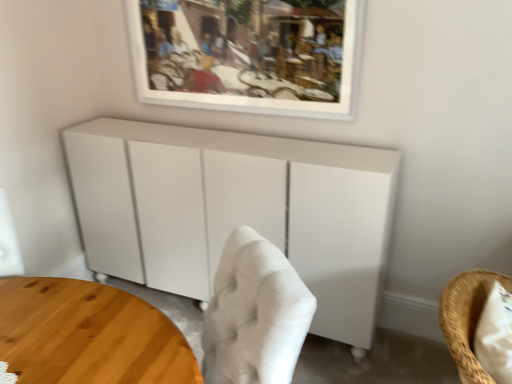
Question: Does point (27, 291) appear closer or farther from the camera than point (458, 365)?

Choices:
 (A) closer
 (B) farther

Answer: (B)

Question: Considering the positions of wooden round table at lower left and woven straw chair at lower right in the image, is wooden round table at lower left bigger or smaller than woven straw chair at lower right?

Choices:
 (A) small
 (B) big

Answer: (B)

Question: Which is nearer to the wooden round table at lower left?

Choices:
 (A) woven straw chair at lower right
 (B) white matte picture frame at upper center
 (C) white matte cabinet at center

Answer: (A)

Question: Estimate the real-world distances between objects in this image. Which object is farther from the wooden round table at lower left?

Choices:
 (A) white matte picture frame at upper center
 (B) woven straw chair at lower right
 (C) white matte cabinet at center

Answer: (A)